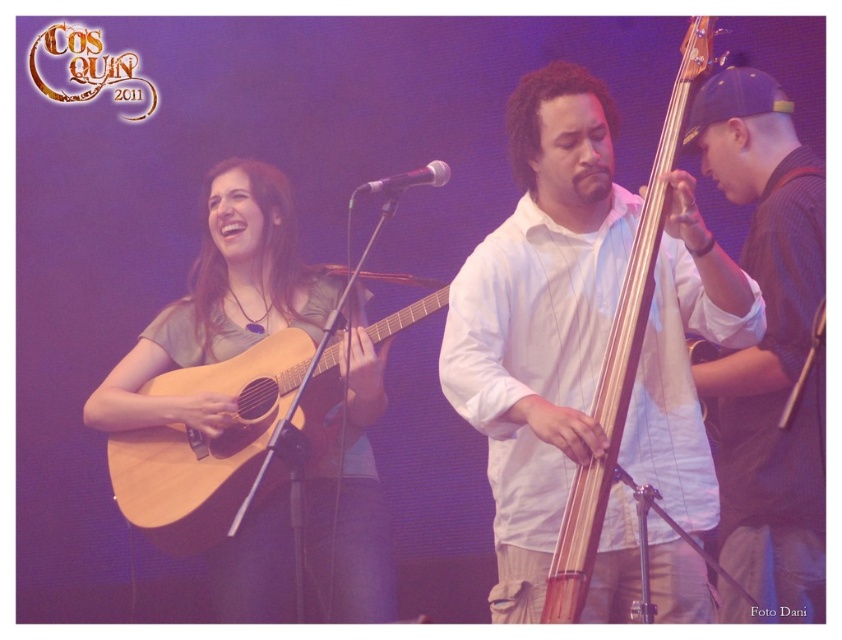
You are a photographer at the concert and want to capture both the natural wood acoustic guitar at center and the metallic silver microphone at center in a single frame. Which object should you zoom in on to ensure both are clearly visible?

You should zoom in on the metallic silver microphone at center because it is smaller than the natural wood acoustic guitar at center, allowing both to fit within the frame more easily.

You are a photographer at the Cos Quin 2011 concert. You want to take a photo of the performer and the natural wood acoustic guitar at left. Where should you position yourself to ensure both are in frame?

To capture both the performer and the natural wood acoustic guitar at left in the photo, position yourself so that the guitar is at the lower right corner of the frame, corresponding to the coordinate point 0.697 on the x axis and 0.246 on the y axis.